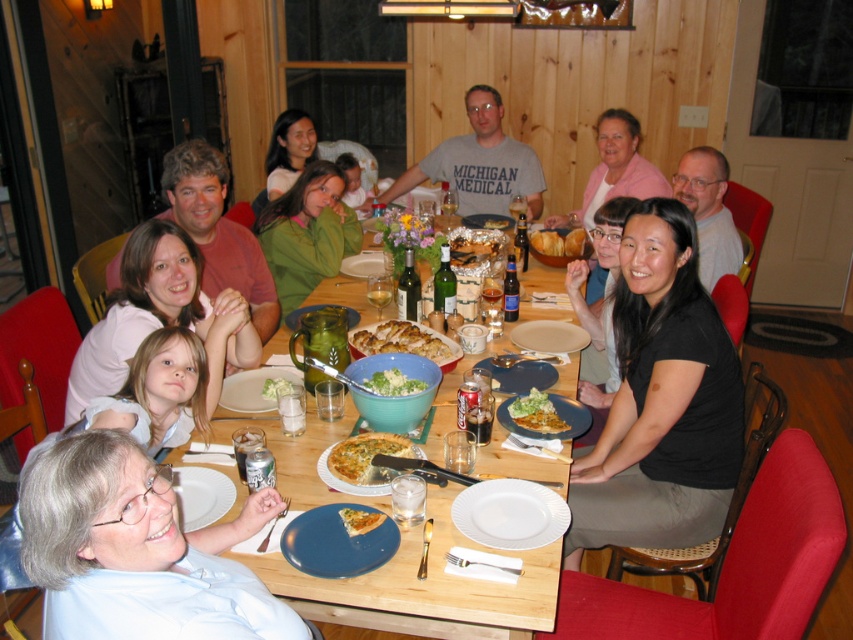
Question: Is golden brown crusty bread at center smaller than green matte salad bowl at center?

Choices:
 (A) yes
 (B) no

Answer: (B)

Question: Is gray cotton t-shirt at center to the right of white matte plate at lower left from the viewer's perspective?

Choices:
 (A) no
 (B) yes

Answer: (B)

Question: Which point is closer to the camera taking this photo?

Choices:
 (A) click(553, 429)
 (B) click(577, 243)
 (C) click(315, 531)
 (D) click(265, 380)

Answer: (C)

Question: Which object is farther from the camera taking this photo?

Choices:
 (A) golden brown bread at center
 (B) white paper plate at lower center
 (C) black matte shirt at center

Answer: (A)

Question: Can you confirm if black matte shirt at center is positioned to the left of wooden table at center?

Choices:
 (A) yes
 (B) no

Answer: (B)

Question: Which of the following is the closest to the observer?

Choices:
 (A) white paper plate at lower center
 (B) white matte plate at lower left
 (C) black matte shirt at center
 (D) gray cotton t-shirt at center

Answer: (A)